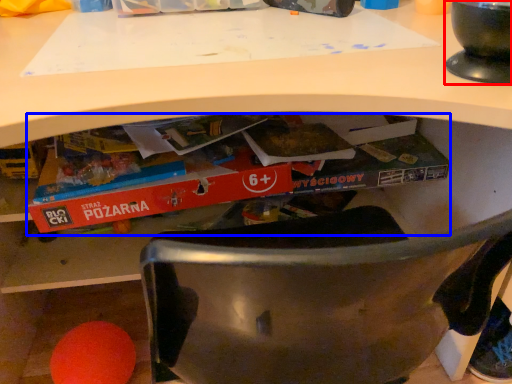
Question: Which point is further to the camera, appliance (highlighted by a red box) or paperback book (highlighted by a blue box)?

Choices:
 (A) appliance
 (B) paperback book

Answer: (B)